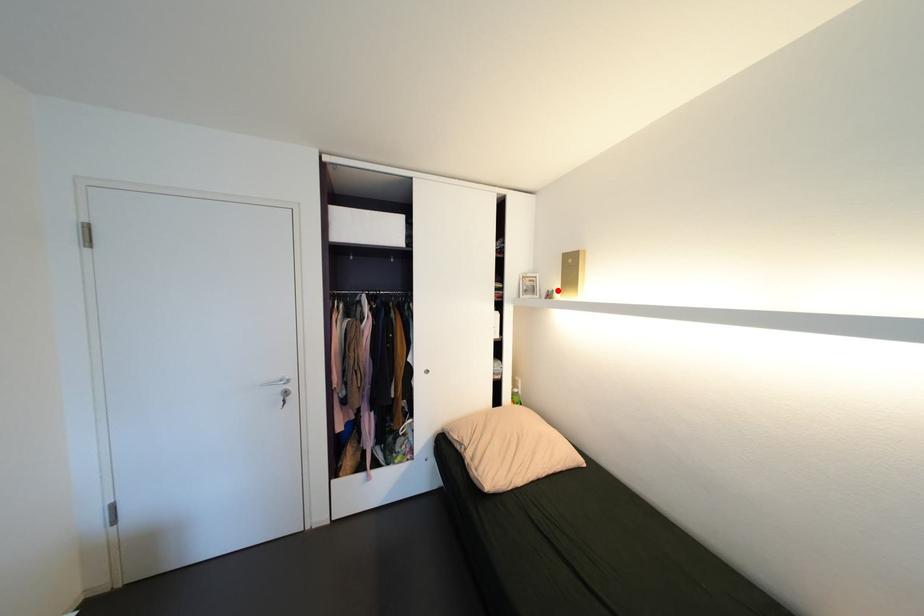
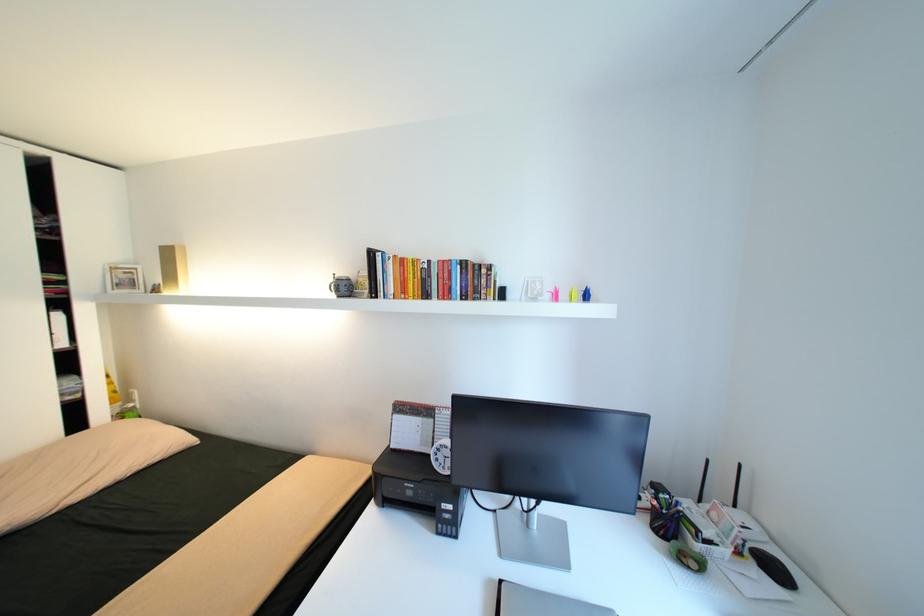
Find the pixel in the second image that matches the highlighted location in the first image.

(164, 284)